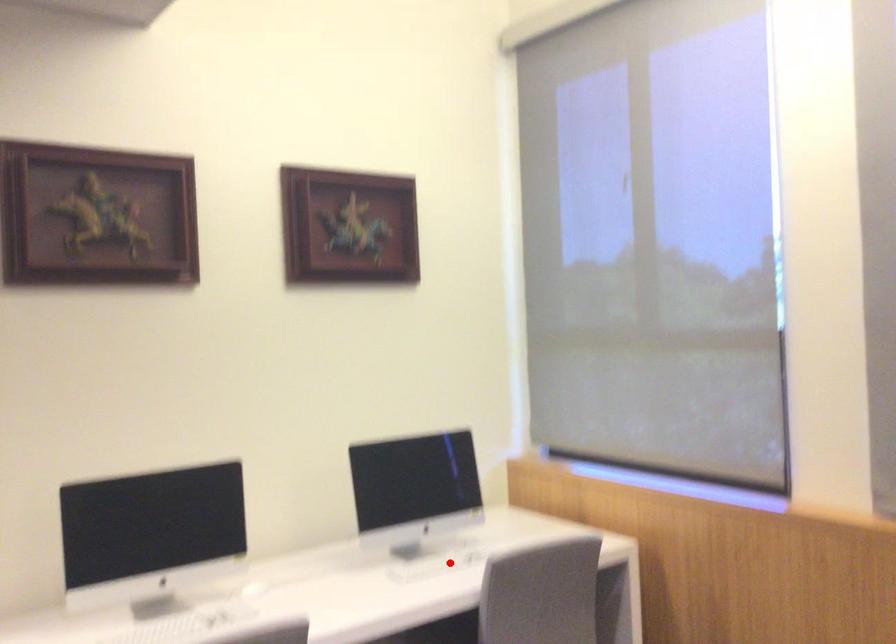
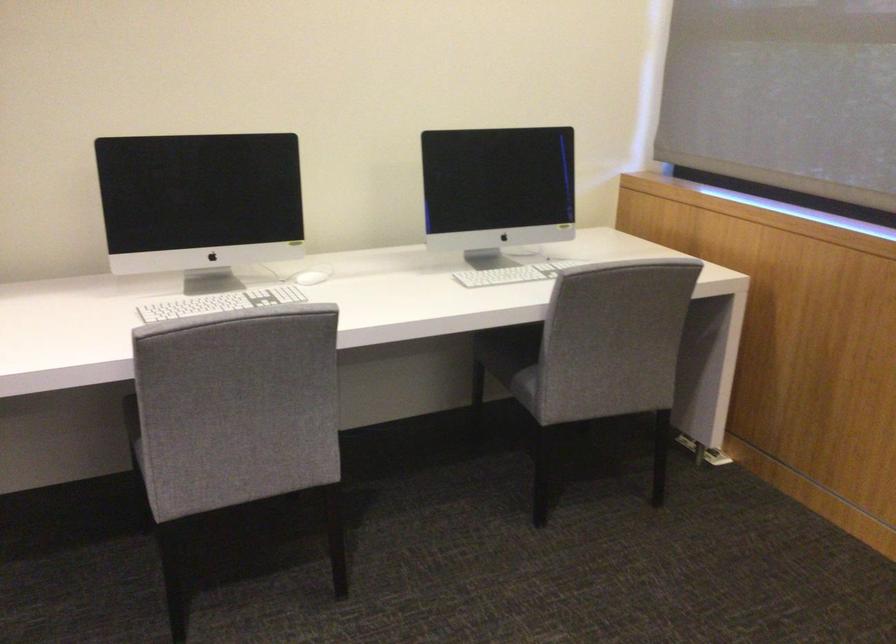
Locate, in the second image, the point that corresponds to the highlighted location in the first image.

(519, 270)